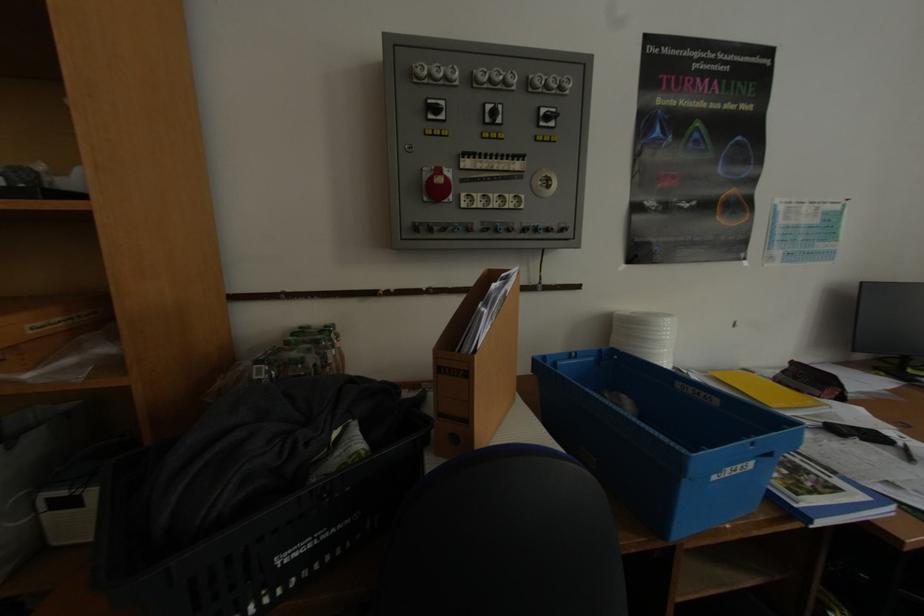
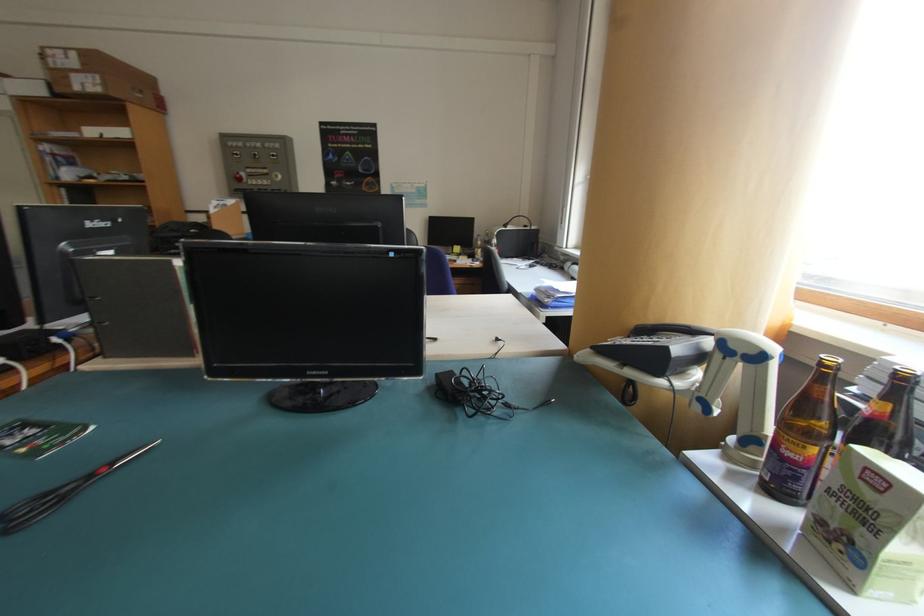
In a continuous first-person perspective shot, in which direction is the camera moving?

The movement direction of the cameraman is right, backward.